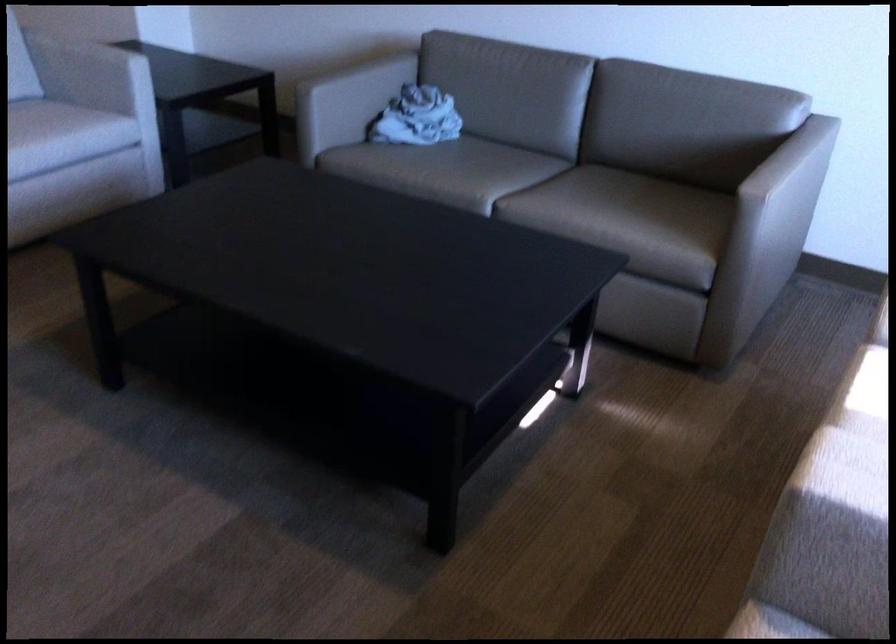
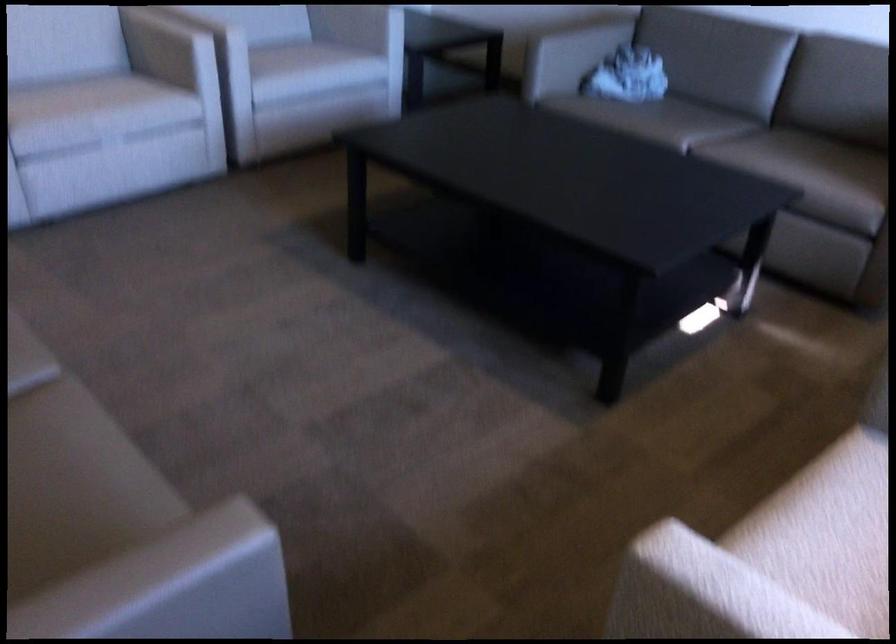
Question: The first image is from the beginning of the video and the second image is from the end. How did the camera likely rotate when shooting the video?

Choices:
 (A) Left
 (B) Right
 (C) Up
 (D) Down

Answer: (A)